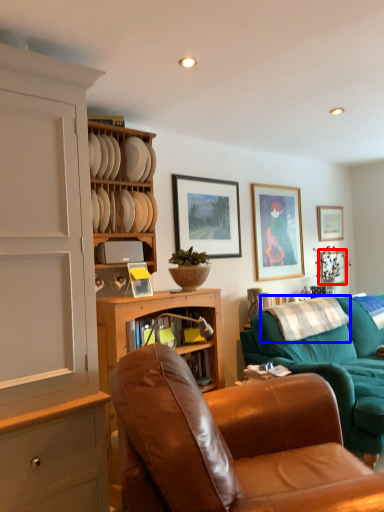
Question: Among these objects, which one is farthest to the camera, picture frame (highlighted by a red box) or pillow (highlighted by a blue box)?

Choices:
 (A) picture frame
 (B) pillow

Answer: (A)